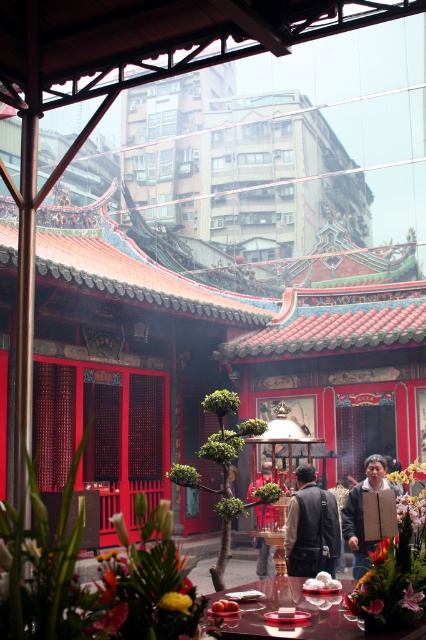
Question: Among these objects, which one is nearest to the camera?

Choices:
 (A) dark brown leather jacket at center
 (B) shiny dark wood table at center
 (C) smooth orange fruit at center

Answer: (B)

Question: Which object is the closest to the dark brown leather jacket at center?

Choices:
 (A) shiny dark wood table at center
 (B) brown fuzzy jacket at center

Answer: (B)

Question: Can you confirm if dark brown leather jacket at center is positioned to the right of smooth orange fruit at center?

Choices:
 (A) yes
 (B) no

Answer: (A)

Question: Does matte pink flower at lower left appear over white fluffy dumplings at center?

Choices:
 (A) no
 (B) yes

Answer: (B)

Question: Which point is closer to the camera taking this photo?

Choices:
 (A) (210, 612)
 (B) (325, 499)
 (C) (373, 611)
 (D) (106, 634)

Answer: (D)

Question: Does dark brown leather jacket at center have a smaller size compared to white fluffy dumplings at center?

Choices:
 (A) yes
 (B) no

Answer: (B)